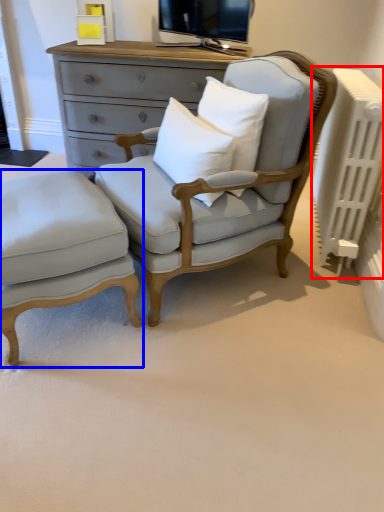
Question: Which object is closer to the camera taking this photo, radiator (highlighted by a red box) or nightstand (highlighted by a blue box)?

Choices:
 (A) radiator
 (B) nightstand

Answer: (B)